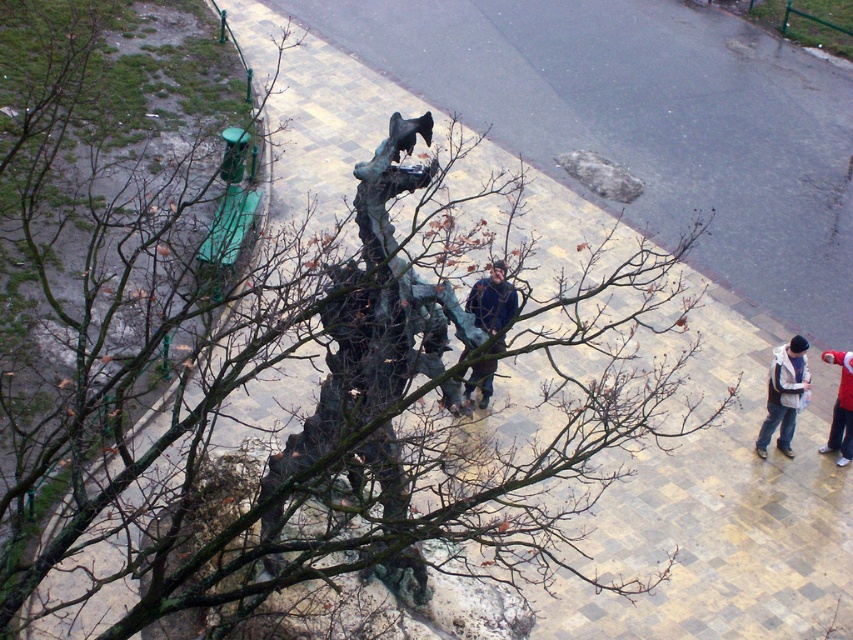
Question: Which object appears closest to the camera in this image?

Choices:
 (A) dark blue jacket at center
 (B) red fabric jacket at lower right

Answer: (A)

Question: Among these objects, which one is farthest from the camera?

Choices:
 (A) red fabric jacket at lower right
 (B) bronze statue at center
 (C) dark blue jacket at center

Answer: (A)

Question: Is bronze statue at center positioned before dark blue jacket at center?

Choices:
 (A) yes
 (B) no

Answer: (A)

Question: Which object appears closest to the camera in this image?

Choices:
 (A) bronze statue at center
 (B) red fabric jacket at lower right

Answer: (A)

Question: Is gray woolen hat at lower right behind dark blue jacket at center?

Choices:
 (A) no
 (B) yes

Answer: (B)

Question: Observing the image, what is the correct spatial positioning of bronze statue at center in reference to dark blue jacket at center?

Choices:
 (A) above
 (B) below

Answer: (B)